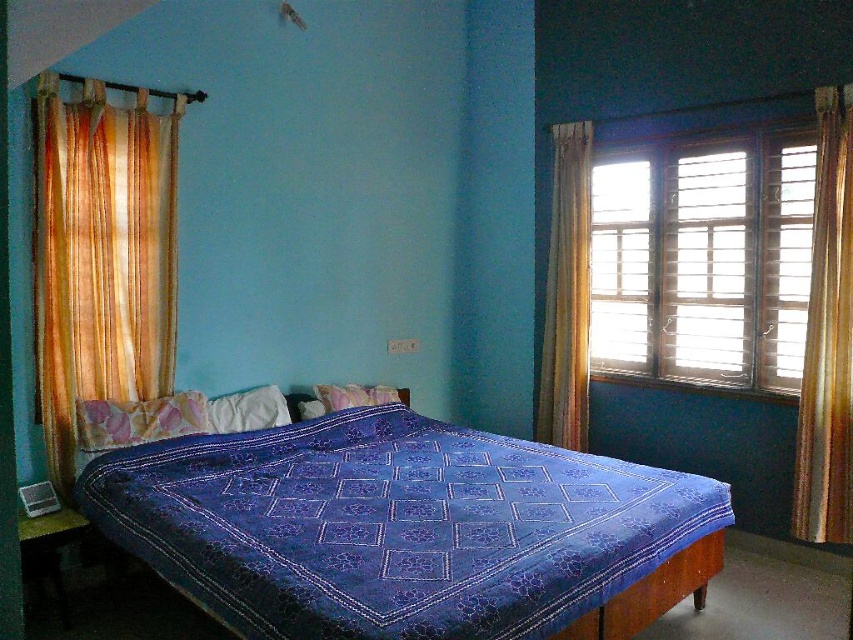
Who is taller, orange sheer curtain at right or purple fabric pillow at center?

orange sheer curtain at right

Which is more to the left, orange sheer curtain at right or purple fabric pillow at center?

purple fabric pillow at center is more to the left.

Does point (799, 449) come farther from viewer compared to point (368, 388)?

No, (799, 449) is in front of (368, 388).

Find the location of a particular element. Image resolution: width=853 pixels, height=640 pixels. orange sheer curtain at right is located at coordinates point(827,337).

Does blue printed fabric at center appear over pink fabric pillow at center?

No, blue printed fabric at center is not above pink fabric pillow at center.

Is blue printed fabric at center in front of pink fabric pillow at center?

Yes.

Is point (524, 636) positioned behind point (80, 419)?

No, (524, 636) is closer to viewer.

Identify the location of blue printed fabric at center. Image resolution: width=853 pixels, height=640 pixels. (407, 529).

Is orange sheer curtain at left thinner than orange sheer curtain at right?

Incorrect, orange sheer curtain at left's width is not less than orange sheer curtain at right's.

Can you confirm if orange sheer curtain at left is positioned to the right of orange sheer curtain at right?

In fact, orange sheer curtain at left is to the left of orange sheer curtain at right.

Is point (45, 416) behind point (846, 490)?

No, (45, 416) is in front of (846, 490).

I want to click on orange sheer curtain at left, so click(x=102, y=256).